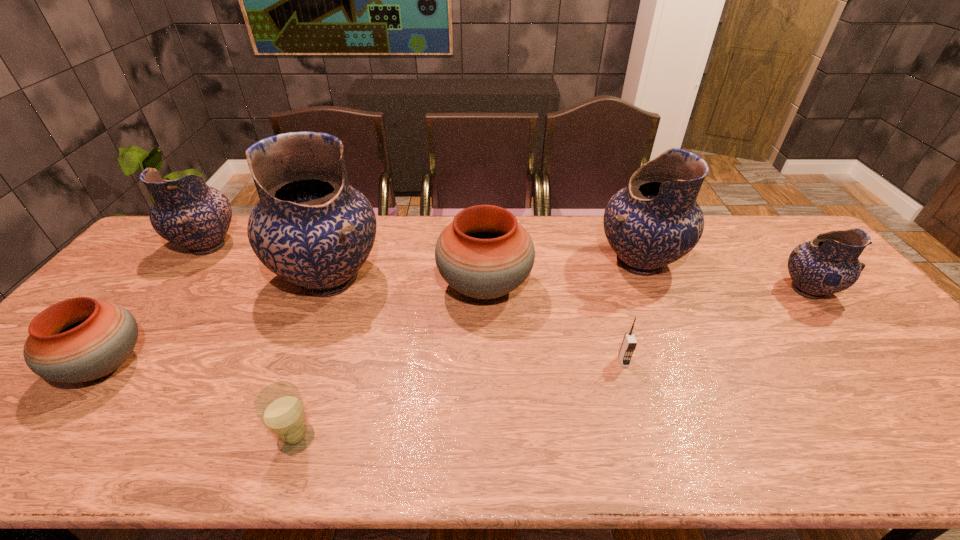
I want to click on the nearest pottery, so click(x=80, y=339).

I want to click on the nearer red pottery, so click(80, 339).

At what (x,y) coordinates should I click in order to perform the action: click on cellular telephone. Please return your answer as a coordinate pair (x, y). The image size is (960, 540). Looking at the image, I should click on (629, 343).

Locate an element on the screen. the nearest object is located at coordinates (279, 406).

Locate an element on the screen. blue glass is located at coordinates (279, 406).

Where is `free space located 0.300m on the left of the second blue pottery from left to right`? This screenshot has width=960, height=540. free space located 0.300m on the left of the second blue pottery from left to right is located at coordinates (175, 279).

Identify the location of free space located on the right of the third blue pottery from left to right. (732, 262).

Locate an element on the screen. vacant area situated 0.270m on the right of the second smallest blue pottery is located at coordinates (324, 246).

Where is `vacant space located 0.200m on the right of the farther red pottery`? The width and height of the screenshot is (960, 540). vacant space located 0.200m on the right of the farther red pottery is located at coordinates point(599,287).

The image size is (960, 540). What are the coordinates of `free space located on the left of the smallest blue pottery` in the screenshot? It's located at (704, 290).